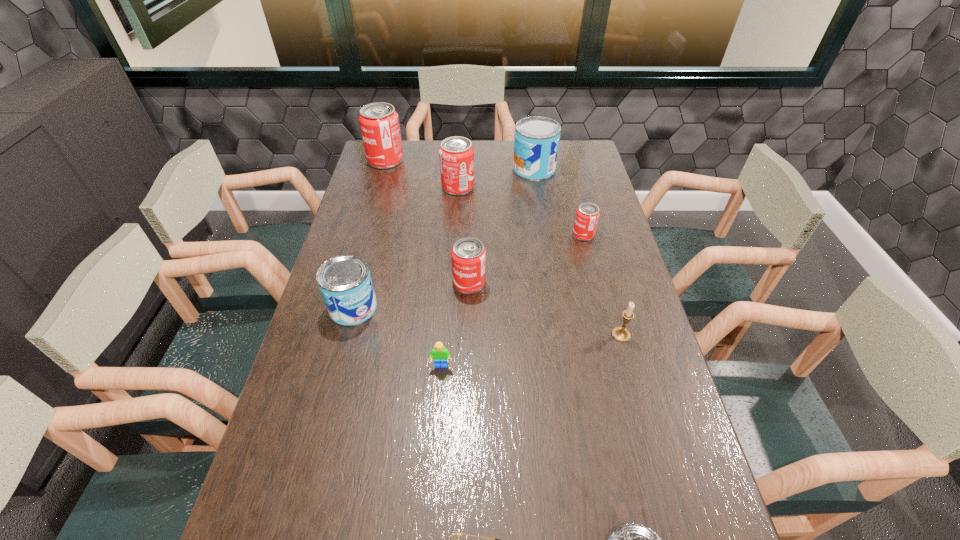
At what (x,y) coordinates should I click in order to perform the action: click on object located in the far left corner section of the desktop. Please return your answer as a coordinate pair (x, y). Looking at the image, I should click on (379, 123).

This screenshot has width=960, height=540. I want to click on object positioned at the far right corner, so click(x=536, y=143).

This screenshot has width=960, height=540. I want to click on vacant space at the far edge of the desktop, so click(443, 141).

Where is `free space at the left edge of the desktop`? free space at the left edge of the desktop is located at coordinates (398, 195).

Where is `free space at the right edge`? Image resolution: width=960 pixels, height=540 pixels. free space at the right edge is located at coordinates (672, 442).

Locate an element on the screen. The height and width of the screenshot is (540, 960). blank region between the candle holder and the third nearest red can is located at coordinates (540, 261).

At what (x,y) coordinates should I click in order to perform the action: click on vacant space in between the second farthest blue can and the second smallest red can. Please return your answer as a coordinate pair (x, y). The image size is (960, 540). Looking at the image, I should click on (411, 295).

Locate an element on the screen. The image size is (960, 540). vacant space in between the second smallest red can and the second farthest red can is located at coordinates (464, 235).

At what (x,y) coordinates should I click in order to perform the action: click on vacant space in between the ninth tallest object and the leftmost blue can. Please return your answer as a coordinate pair (x, y). Looking at the image, I should click on (397, 336).

The width and height of the screenshot is (960, 540). Identify the location of object that is the third nearest to the rightmost red can. (621, 334).